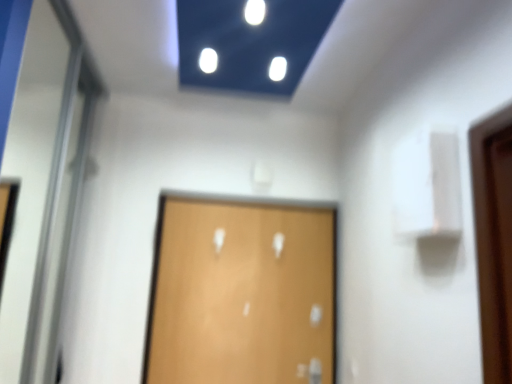
Question: From their relative heights in the image, would you say wooden door at center is taller or shorter than white glossy elevator door at left?

Choices:
 (A) tall
 (B) short

Answer: (B)

Question: In terms of size, does wooden door at center appear bigger or smaller than white glossy elevator door at left?

Choices:
 (A) small
 (B) big

Answer: (A)

Question: Which is correct: wooden door at center is inside white glossy elevator door at left, or outside of it?

Choices:
 (A) inside
 (B) outside

Answer: (B)

Question: Is white glossy elevator door at left wider or thinner than wooden door at center?

Choices:
 (A) thin
 (B) wide

Answer: (B)

Question: From a real-world perspective, is white glossy elevator door at left physically located above or below wooden door at center?

Choices:
 (A) below
 (B) above

Answer: (B)

Question: Is point (49, 140) positioned closer to the camera than point (281, 223)?

Choices:
 (A) farther
 (B) closer

Answer: (B)

Question: From the image's perspective, relative to wooden door at center, is white glossy elevator door at left above or below?

Choices:
 (A) below
 (B) above

Answer: (B)